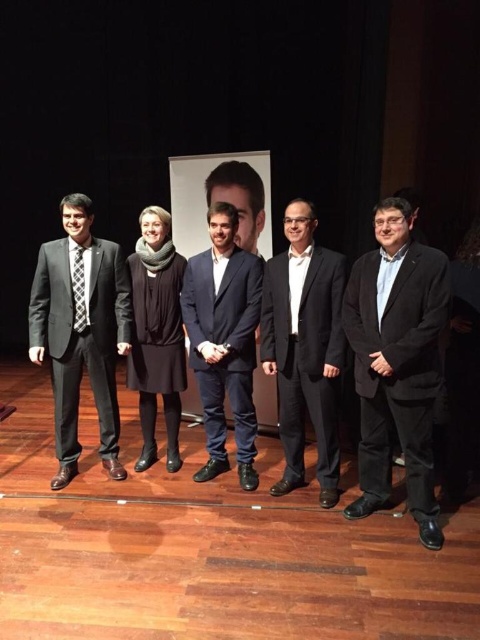
Find the location of a particular element. wooden floor at lower center is located at coordinates [207, 550].

Which is behind, point (358, 586) or point (70, 365)?

The point (70, 365) is behind.

Is point (301, 490) positioned after point (74, 376)?

No, (301, 490) is in front of (74, 376).

The image size is (480, 640). What are the coordinates of `wooden floor at lower center` in the screenshot? It's located at (207, 550).

Does matte black suit at left have a larger size compared to checkered fabric tie at left?

Yes, matte black suit at left is bigger than checkered fabric tie at left.

Measure the distance from matte black suit at left to checkered fabric tie at left.

A distance of 24.03 centimeters exists between matte black suit at left and checkered fabric tie at left.

In the scene shown: Measure the distance between matte black suit at left and camera.

matte black suit at left is 3.21 meters away from camera.

The height and width of the screenshot is (640, 480). In order to click on matte black suit at left in this screenshot , I will do [81, 333].

Describe the element at coordinates (207, 550) in the screenshot. Image resolution: width=480 pixels, height=640 pixels. I see `wooden floor at lower center` at that location.

Between point (339, 586) and point (434, 307), which one is positioned in front?

Positioned in front is point (339, 586).

The height and width of the screenshot is (640, 480). Identify the location of wooden floor at lower center. (207, 550).